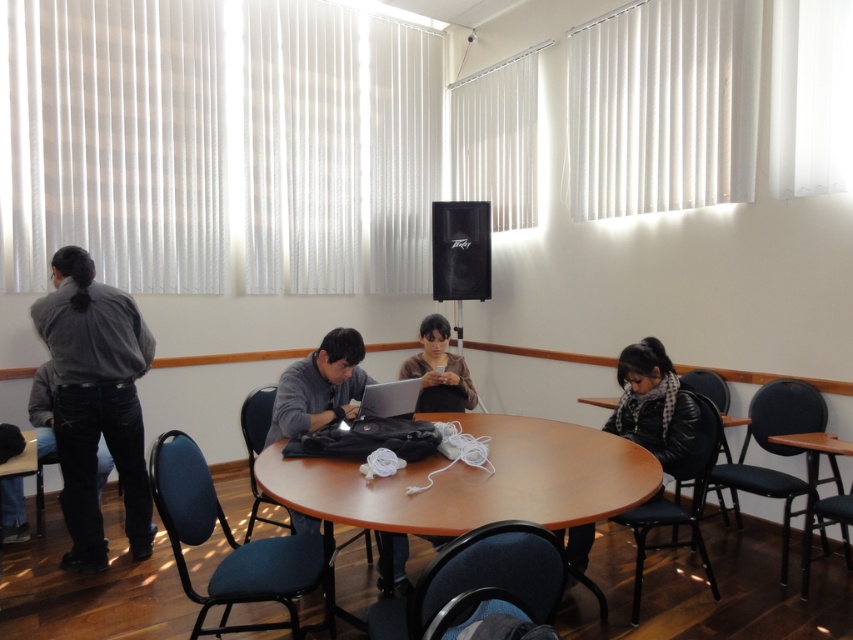
You are standing in the room and want to place a new speaker at the exact center of the table. The current speaker is located at point (x=460, y=250). Is the current speaker already at the center of the table?

The black matte speaker at upper center is represented by point (x=460, y=250). Since the question states that this point is the exact center of the table, the current speaker is already at the center of the table.

You are standing in the room and want to pick up an object. You notice two points marked on the table. Which point is closer to you, point at (485, 268) or point at (727, 449)?

Point at (485, 268) is further to the camera than point at (727, 449), so the point at (727, 449) is closer to you.